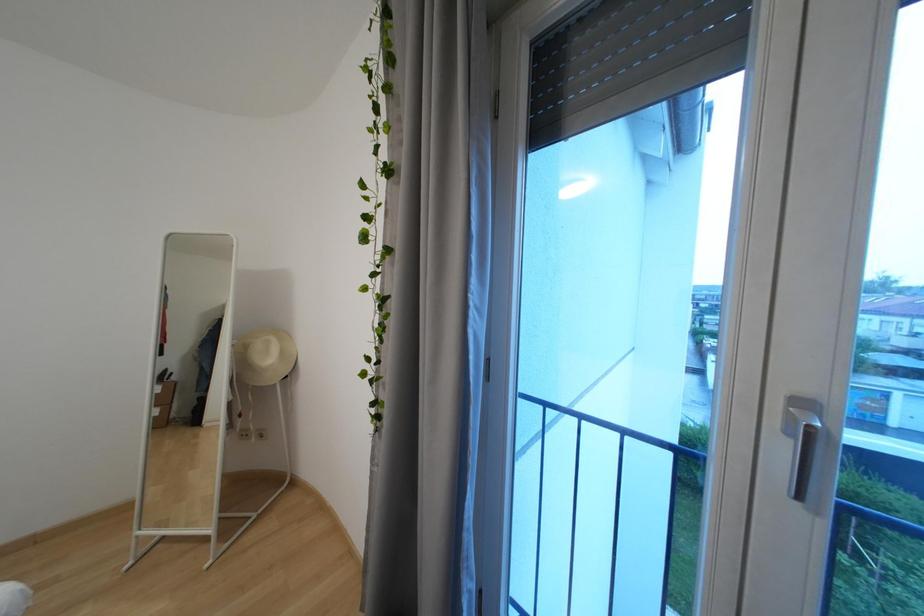
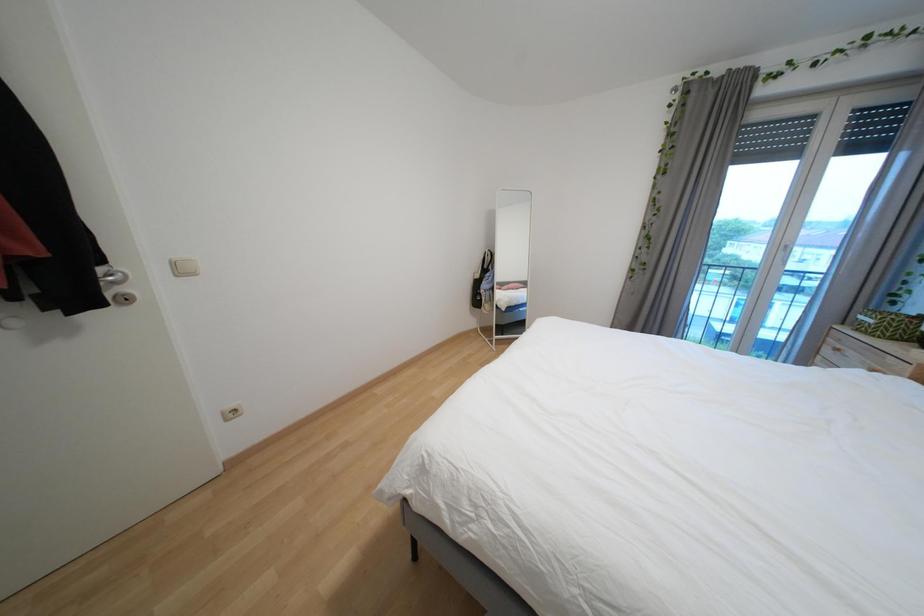
What movement of the cameraman would produce the second image?

The cameraman walked toward left, backward.